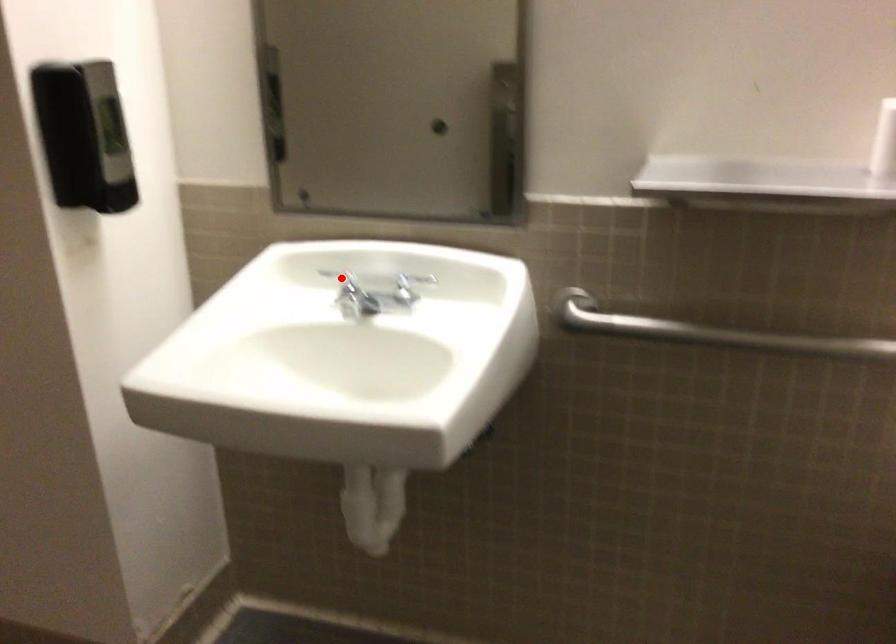
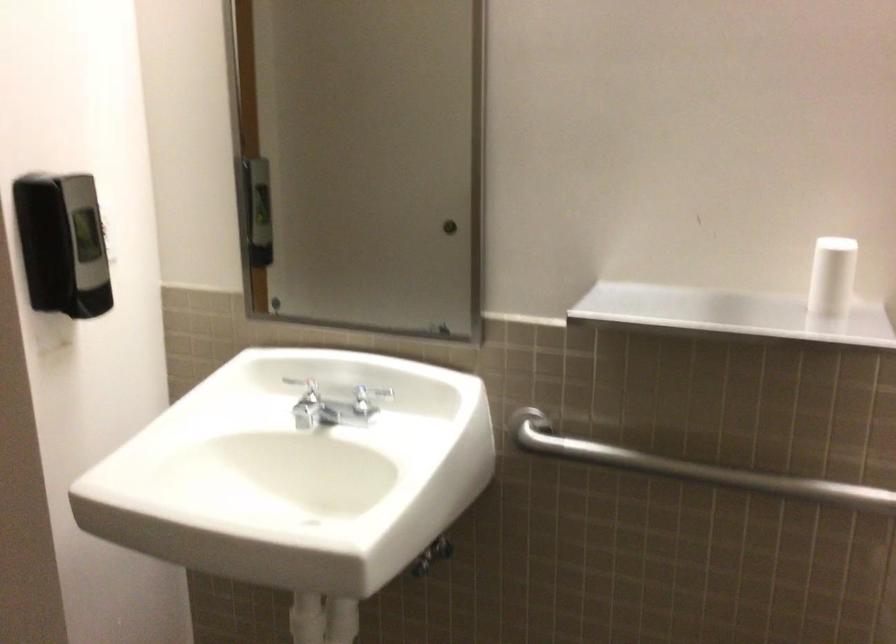
In the second image, find the point that corresponds to the highlighted location in the first image.

(305, 389)